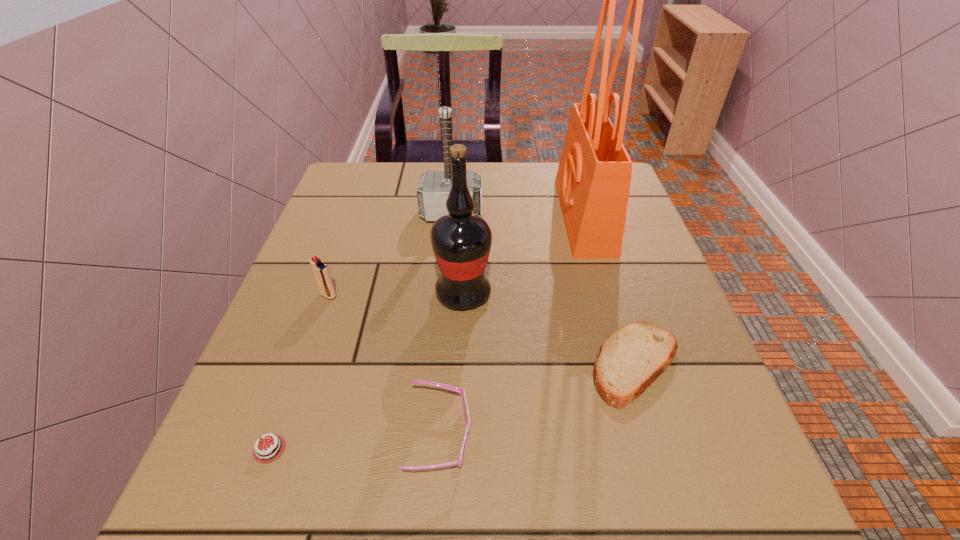
In the image, there is a desktop. Find the location of `free space at the far left corner`. free space at the far left corner is located at coordinates (385, 190).

In the image, there is a desktop. At what (x,y) coordinates should I click in order to perform the action: click on vacant space at the near left corner. Please return your answer as a coordinate pair (x, y). This screenshot has height=540, width=960. Looking at the image, I should click on (207, 477).

Identify the location of free space at the near right corner of the desktop. (734, 507).

Find the location of a particular element. This screenshot has width=960, height=540. free space between the fourth shortest object and the hammer is located at coordinates pyautogui.click(x=390, y=254).

This screenshot has width=960, height=540. I want to click on free spot between the wine bottle and the tallest object, so click(x=524, y=255).

I want to click on vacant area that lies between the shortest object and the second tallest object, so click(x=367, y=372).

Identify the location of empty location between the chocolate cake and the igniter. The height and width of the screenshot is (540, 960). (300, 372).

The height and width of the screenshot is (540, 960). I want to click on vacant area that lies between the second shortest object and the fifth shortest object, so click(x=543, y=289).

The width and height of the screenshot is (960, 540). What are the coordinates of `free space between the igniter and the wine bottle` in the screenshot? It's located at click(x=396, y=294).

The height and width of the screenshot is (540, 960). I want to click on vacant area that lies between the pita bread and the igniter, so click(482, 330).